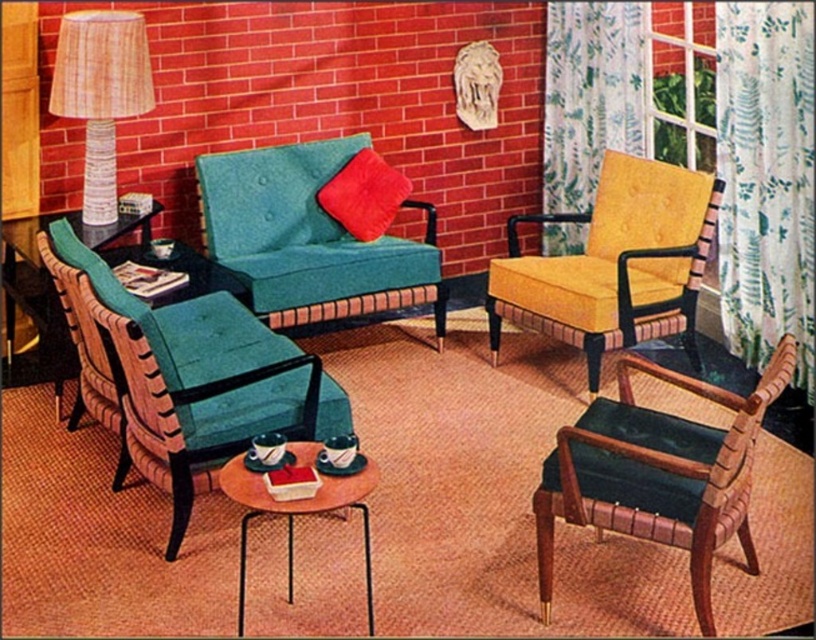
Is point (198, 196) behind point (584, 128)?

No, (198, 196) is closer to viewer.

Looking at this image, how much distance is there between teal fabric couch at center and green floral fabric curtain at upper right?

teal fabric couch at center and green floral fabric curtain at upper right are 1.70 meters apart.

Does point (271, 323) lie behind point (566, 150)?

No, (271, 323) is in front of (566, 150).

The height and width of the screenshot is (640, 816). I want to click on teal fabric couch at center, so click(x=309, y=237).

Consider the image. Which is above, yellow fabric armchair at right or wooden round table at center?

yellow fabric armchair at right is higher up.

Is yellow fabric armchair at right below wooden round table at center?

No, yellow fabric armchair at right is not below wooden round table at center.

Is point (695, 172) behind point (296, 460)?

That is True.

Locate an element on the screen. Image resolution: width=816 pixels, height=640 pixels. yellow fabric armchair at right is located at coordinates (614, 264).

Is the position of teal fabric armchair at center less distant than that of wooden round table at center?

No, it is not.

Between teal fabric armchair at center and wooden round table at center, which one has less height?

With less height is wooden round table at center.

Does point (287, 397) come in front of point (370, 576)?

That is False.

What are the coordinates of `teal fabric armchair at center` in the screenshot? It's located at (193, 378).